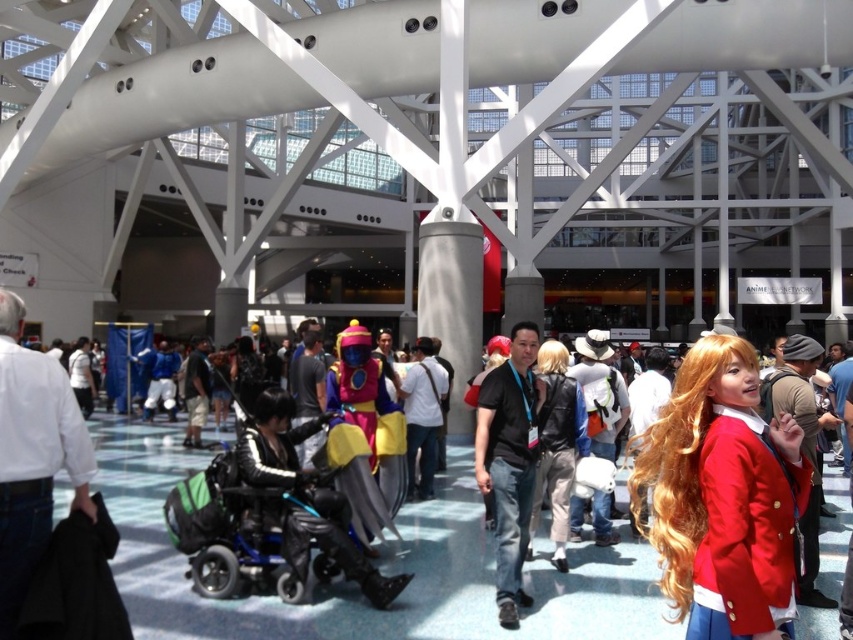
Is point (502, 616) positioned before point (347, 547)?

Yes.

Is black matte shirt at center thinner than shiny metallic costume at center?

In fact, black matte shirt at center might be wider than shiny metallic costume at center.

Which is behind, point (492, 506) or point (308, 484)?

Positioned behind is point (492, 506).

Locate an element on the screen. Image resolution: width=853 pixels, height=640 pixels. black matte shirt at center is located at coordinates (509, 460).

Which is more to the right, satin red blazer at center or black matte shirt at center?

satin red blazer at center

Between point (666, 420) and point (511, 362), which one is positioned behind?

Positioned behind is point (511, 362).

The height and width of the screenshot is (640, 853). I want to click on satin red blazer at center, so click(x=724, y=497).

Is satin red blazer at center closer to the viewer compared to shiny metallic costume at center?

That is True.

Is point (775, 593) closer to camera compared to point (305, 541)?

That is True.

Locate an element on the screen. This screenshot has height=640, width=853. satin red blazer at center is located at coordinates (724, 497).